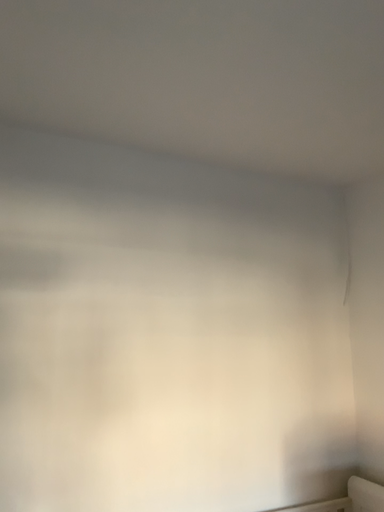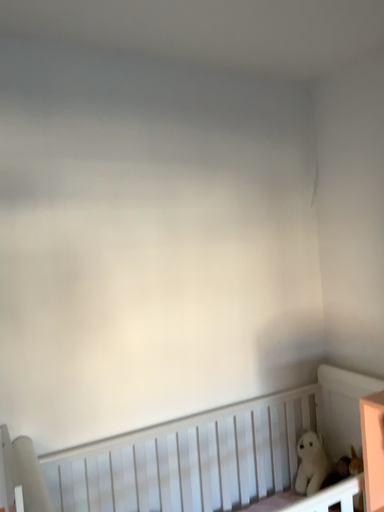
Question: Which way did the camera rotate in the video?

Choices:
 (A) rotated upward
 (B) rotated downward

Answer: (B)